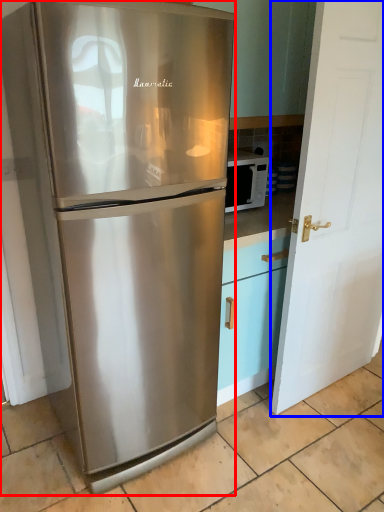
Question: Which object is closer to the camera taking this photo, refrigerator (highlighted by a red box) or door (highlighted by a blue box)?

Choices:
 (A) refrigerator
 (B) door

Answer: (A)